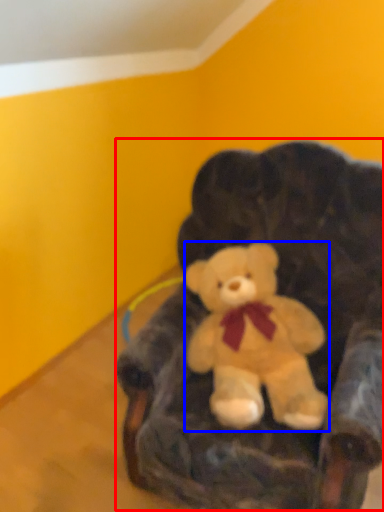
Question: Which object appears closest to the camera in this image, bean bag chair (highlighted by a red box) or teddy bear (highlighted by a blue box)?

Choices:
 (A) bean bag chair
 (B) teddy bear

Answer: (A)